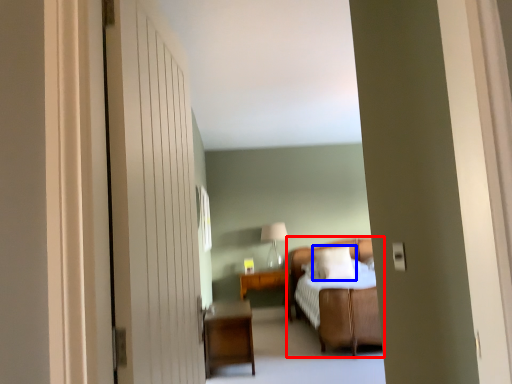
Question: Which object appears closest to the camera in this image, bed (highlighted by a red box) or pillow (highlighted by a blue box)?

Choices:
 (A) bed
 (B) pillow

Answer: (A)